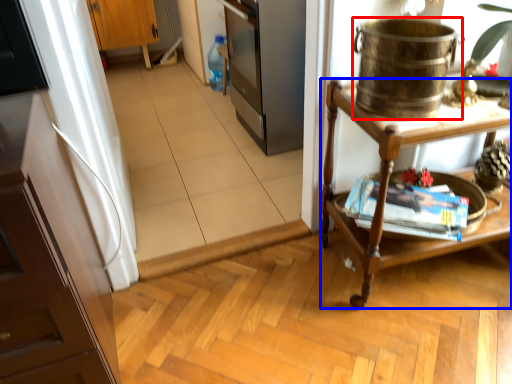
Question: Which point is closer to the camera, appliance (highlighted by a red box) or desk (highlighted by a blue box)?

Choices:
 (A) appliance
 (B) desk

Answer: (A)